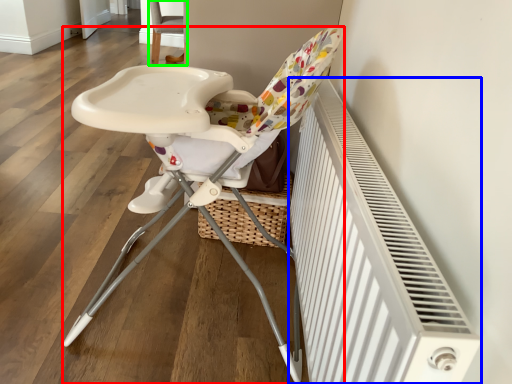
Question: Estimate the real-world distances between objects in this image. Which object is closer to chair (highlighted by a red box), radiator (highlighted by a blue box) or chair (highlighted by a green box)?

Choices:
 (A) radiator
 (B) chair

Answer: (A)